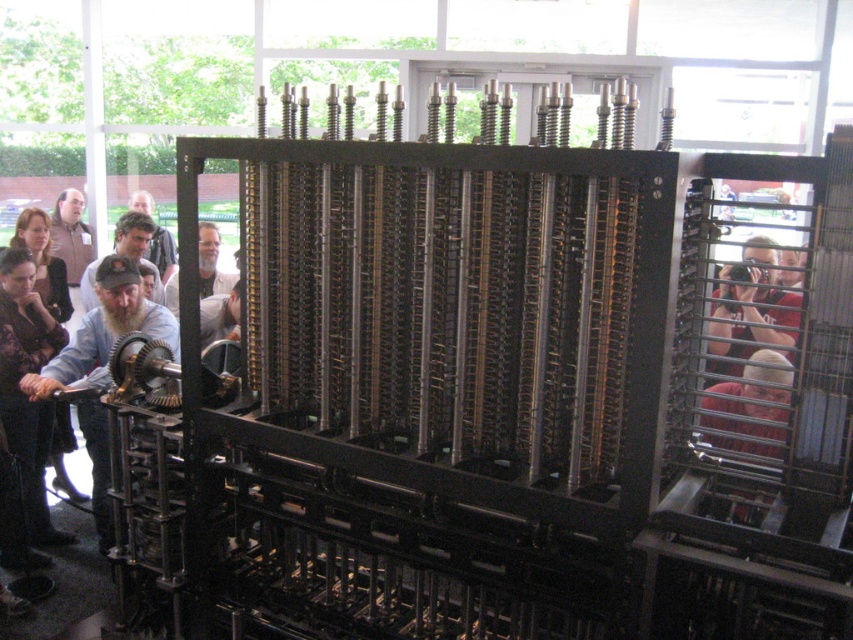
Question: Which point appears farthest from the camera in this image?

Choices:
 (A) (798, 317)
 (B) (85, 284)
 (C) (44, 372)

Answer: (B)

Question: Considering the relative positions of light brown leather jacket at left and gray beard at center in the image provided, where is light brown leather jacket at left located with respect to gray beard at center?

Choices:
 (A) above
 (B) below

Answer: (A)

Question: Which point is closer to the camera?

Choices:
 (A) (0, 305)
 (B) (207, 224)
 (C) (120, 269)

Answer: (C)

Question: Does dark brown leather jacket at left appear on the left side of red shirt at right?

Choices:
 (A) no
 (B) yes

Answer: (B)

Question: Does beige fabric cap at left have a greater width compared to light brown hair at center?

Choices:
 (A) yes
 (B) no

Answer: (A)

Question: Considering the real-world distances, which object is closest to the light brown hair at center?

Choices:
 (A) dark brown leather jacket at left
 (B) red shirt at right
 (C) matte black camera at right

Answer: (A)